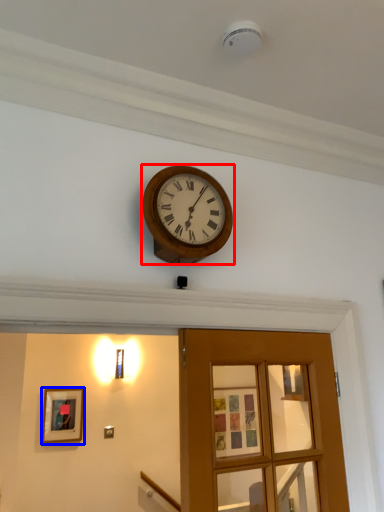
Question: Which object is closer to the camera taking this photo, wall clock (highlighted by a red box) or picture frame (highlighted by a blue box)?

Choices:
 (A) wall clock
 (B) picture frame

Answer: (A)